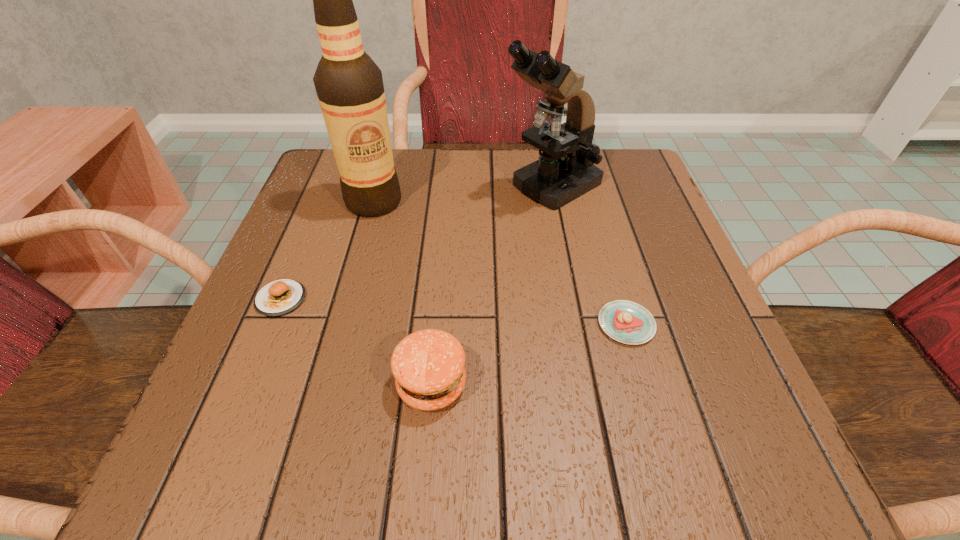
Locate an element on the screen. This screenshot has width=960, height=540. object that stands as the fourth closest to the second tallest object is located at coordinates pyautogui.click(x=280, y=297).

Point out which object is positioned as the fourth nearest to the pastry. Please provide its 2D coordinates. Your answer should be formatted as a tuple, i.e. [(x, y)], where the tuple contains the x and y coordinates of a point satisfying the conditions above.

[(280, 297)]

You are a GUI agent. You are given a task and a screenshot of the screen. Output one action in this format:
    pyautogui.click(x=<x>, y=<y>)
    Task: Click on the free location that satisfies the following two spatial constraints: 1. on the label of the third shortest object; 2. on the right side of the alcohol
    The image size is (960, 540).
    Given the screenshot: What is the action you would take?
    pyautogui.click(x=324, y=384)

This screenshot has width=960, height=540. I want to click on free space that satisfies the following two spatial constraints: 1. on the label of the alcohol; 2. on the right side of the pastry, so click(x=340, y=324).

The image size is (960, 540). What are the coordinates of `free space that satisfies the following two spatial constraints: 1. on the label of the second object from left to right; 2. on the left side of the pastry` in the screenshot? It's located at (340, 324).

You are a GUI agent. You are given a task and a screenshot of the screen. Output one action in this format:
    pyautogui.click(x=<x>, y=<y>)
    Task: Click on the free space in the image that satisfies the following two spatial constraints: 1. on the back side of the nearest object; 2. on the right side of the fourth shortest object
    This screenshot has height=540, width=960.
    Given the screenshot: What is the action you would take?
    pyautogui.click(x=448, y=186)

At what (x,y) coordinates should I click in order to perform the action: click on free space that satisfies the following two spatial constraints: 1. on the label of the pastry; 2. on the right side of the second object from left to right. Please return your answer as a coordinate pair (x, y). Image resolution: width=960 pixels, height=540 pixels. Looking at the image, I should click on (340, 324).